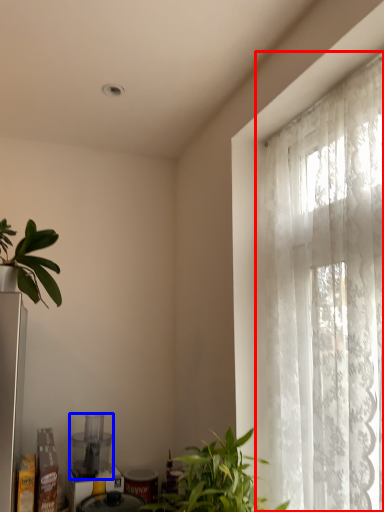
Question: Which of the following is the farthest to the observer, window (highlighted by a red box) or appliance (highlighted by a blue box)?

Choices:
 (A) window
 (B) appliance

Answer: (B)